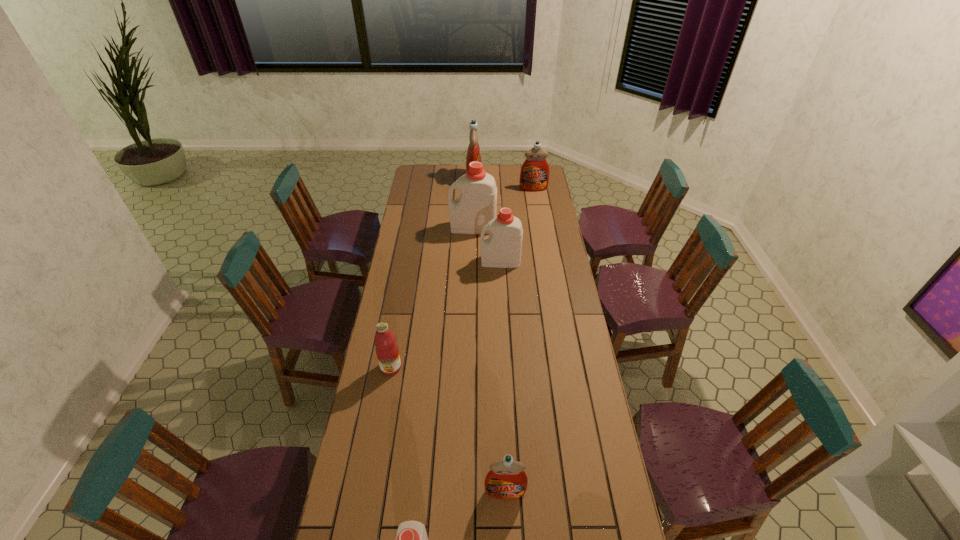
Locate an element on the screen. object that stands as the fifth closest to the smallest red detergent is located at coordinates (534, 176).

The image size is (960, 540). I want to click on the fifth closest detergent to the second smallest red detergent, so click(x=411, y=539).

Identify the location of the sixth closest detergent to the pink fruit juice. The width and height of the screenshot is (960, 540). (534, 176).

What are the coordinates of `red detergent that stands as the closest to the rightmost object` in the screenshot? It's located at (473, 153).

Find the location of a particular element. This screenshot has height=540, width=960. red detergent that is the closest to the smallest white detergent is located at coordinates (506, 480).

Where is `white detergent that is the third closest one to the biggest red detergent`? This screenshot has height=540, width=960. white detergent that is the third closest one to the biggest red detergent is located at coordinates (411, 539).

Where is `white detergent that is the third nearest to the rightmost red detergent`? This screenshot has height=540, width=960. white detergent that is the third nearest to the rightmost red detergent is located at coordinates (411, 539).

The height and width of the screenshot is (540, 960). In order to click on free point that satisfies the following two spatial constraints: 1. on the handle side of the fourth farthest object; 2. on the front surface of the smallest red detergent in this screenshot , I will do `click(513, 491)`.